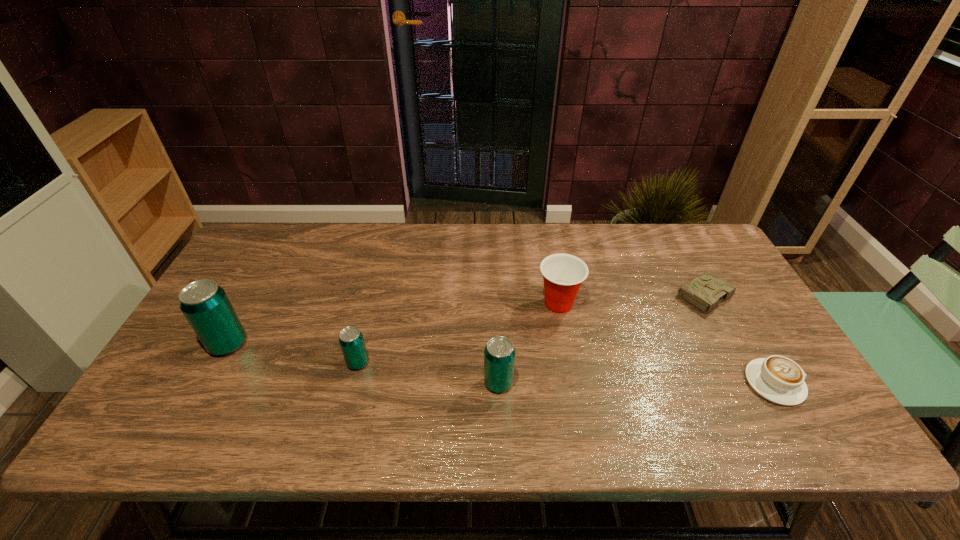
The beer cans are evenly distributed in the image. To maintain this, where would you place another beer can on the right? Please point to a free space. Please provide its 2D coordinates. Your answer should be formatted as a tuple, i.e. [(x, y)], where the tuple contains the x and y coordinates of a point satisfying the conditions above.

[(651, 405)]